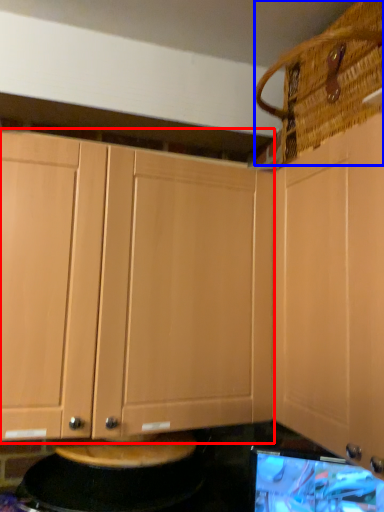
Question: Which of the following is the closest to the observer, cabinetry (highlighted by a red box) or basket (highlighted by a blue box)?

Choices:
 (A) cabinetry
 (B) basket

Answer: (B)